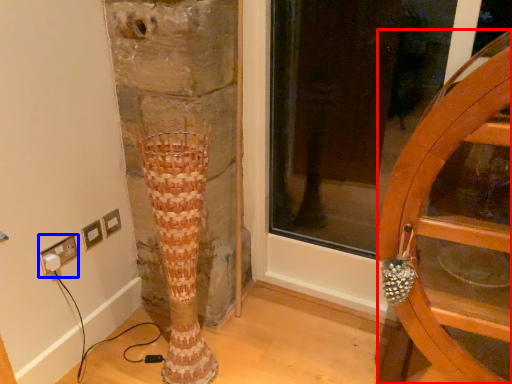
Question: Among these objects, which one is nearest to the camera, furniture (highlighted by a red box) or electric outlet (highlighted by a blue box)?

Choices:
 (A) furniture
 (B) electric outlet

Answer: (A)